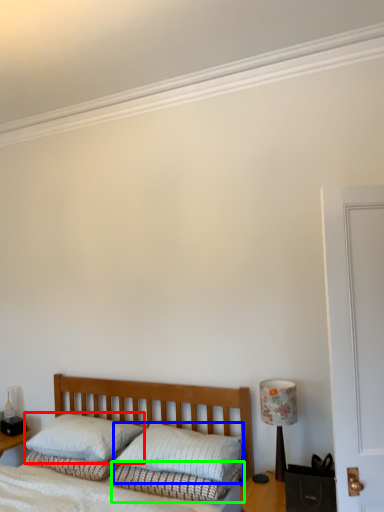
Question: Which object is the closest to the pillow (highlighted by a red box)? Choose among these: pillow (highlighted by a blue box) or bedding (highlighted by a green box).

Choices:
 (A) pillow
 (B) bedding

Answer: (A)